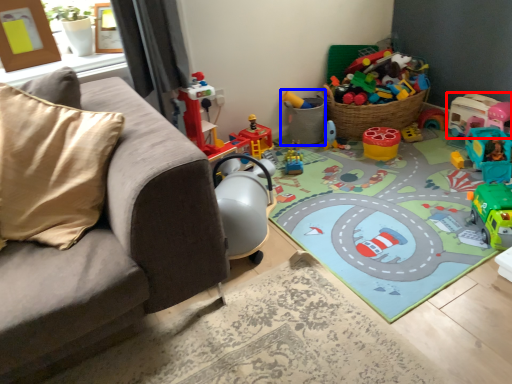
Question: Which of the following is the farthest to the observer, toy (highlighted by a red box) or toy (highlighted by a blue box)?

Choices:
 (A) toy
 (B) toy

Answer: (B)